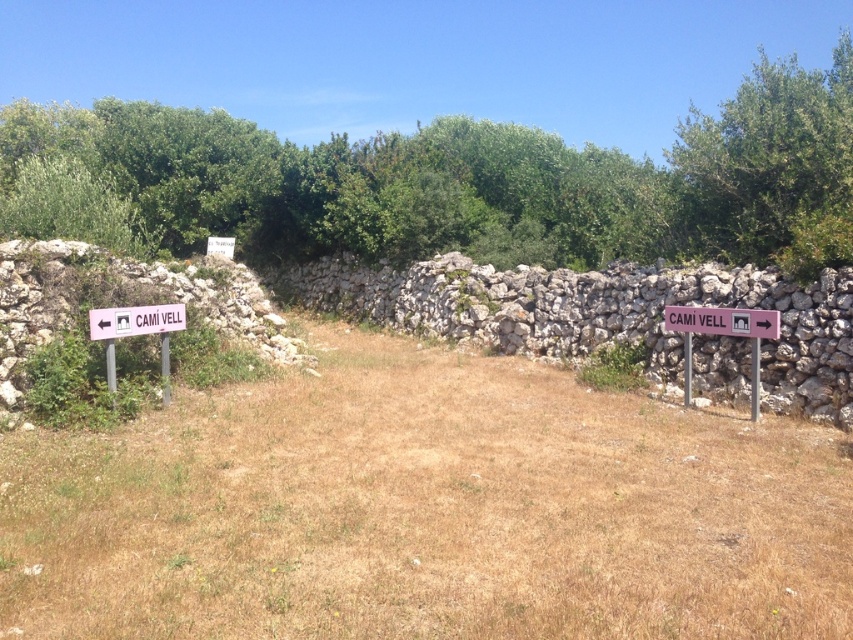
You are standing at the point with coordinates (x=723, y=321). Which object are you closest to?

The pink plastic sign at right is represented by point (x=723, y=321), so you are closest to the pink plastic sign at right.